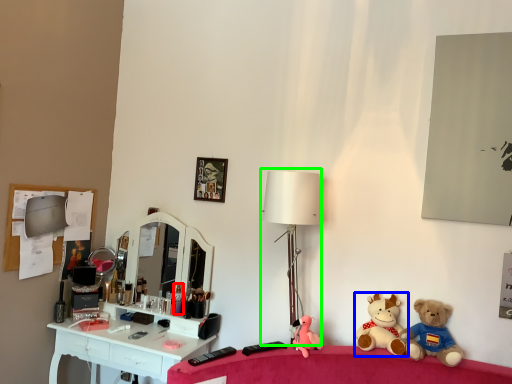
Question: Which object is positioned farthest from toiletry (highlighted by a red box)? Select from toy (highlighted by a blue box) and table lamp (highlighted by a green box).

Choices:
 (A) toy
 (B) table lamp

Answer: (A)